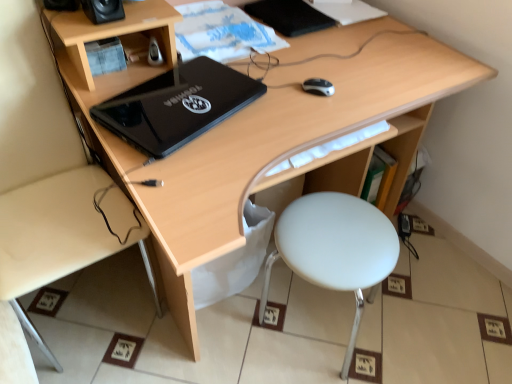
Question: Relative to black plastic mouse at center, is black plastic speaker at upper left, the 2th speaker from the right, in front or behind?

Choices:
 (A) behind
 (B) front

Answer: (B)

Question: From the image's perspective, is black plastic speaker at upper left, the 2th speaker from the right, above or below black plastic mouse at center?

Choices:
 (A) above
 (B) below

Answer: (A)

Question: Based on their relative distances, which object is farther from the black matte notebook at upper center?

Choices:
 (A) black plastic mouse at center
 (B) black plastic speaker at upper left, the 2th speaker from the right
 (C) black glossy laptop at center
 (D) light wood desk at lower left
 (E) white plastic stool at lower right

Answer: (D)

Question: Estimate the real-world distances between objects in this image. Which object is farther from the black plastic speaker at upper left, which is the first speaker from left to right?

Choices:
 (A) black matte notebook at upper center
 (B) black matte speaker at upper left, the first speaker in the right-to-left sequence
 (C) black glossy laptop at center
 (D) light wood desk at lower left
 (E) white plastic stool at lower right

Answer: (E)